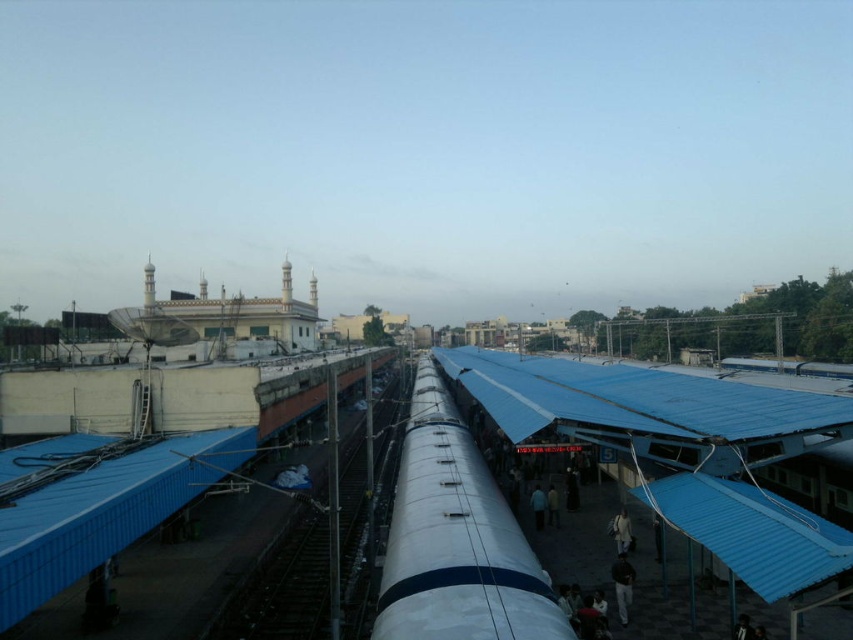
Question: Does smooth metal train track at center appear on the left side of light brown fabric jacket at lower right?

Choices:
 (A) no
 (B) yes

Answer: (B)

Question: Which point is closer to the camera?

Choices:
 (A) (534, 522)
 (B) (297, 616)
 (C) (624, 595)

Answer: (C)

Question: Which object is the farthest from the silver metallic train at center?

Choices:
 (A) dark blue fabric at center
 (B) dark gray fabric pants at lower right
 (C) light brown fabric jacket at lower right

Answer: (A)

Question: From the image, what is the correct spatial relationship of silver metallic train at center in relation to light brown fabric jacket at lower right?

Choices:
 (A) below
 (B) above

Answer: (B)

Question: Does dark gray fabric pants at lower right have a greater width compared to light brown fabric jacket at lower right?

Choices:
 (A) no
 (B) yes

Answer: (A)

Question: Which point is farther to the camera?

Choices:
 (A) (534, 492)
 (B) (468, 620)
 (C) (323, 636)
 (D) (621, 573)

Answer: (A)